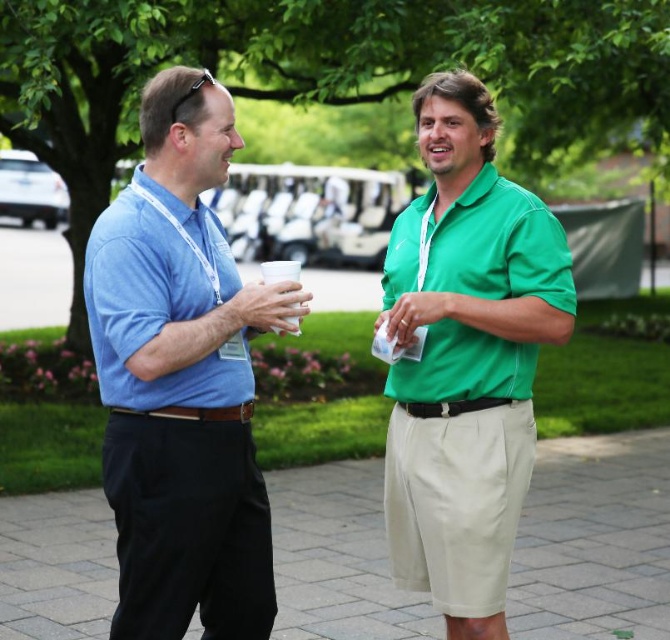
Question: In this image, where is paved stone pavement at center located relative to matte blue polo shirt at left?

Choices:
 (A) below
 (B) above

Answer: (A)

Question: Does matte blue shirt at left come in front of paved stone pavement at center?

Choices:
 (A) yes
 (B) no

Answer: (A)

Question: Which point is closer to the camera?

Choices:
 (A) matte blue polo shirt at left
 (B) green leafy tree at upper center
 (C) matte blue shirt at left

Answer: (C)

Question: Where is matte blue shirt at left located in relation to matte blue polo shirt at left in the image?

Choices:
 (A) right
 (B) left

Answer: (A)

Question: Estimate the real-world distances between objects in this image. Which object is farther from the matte blue polo shirt at left?

Choices:
 (A) matte blue shirt at left
 (B) matte green polo shirt at right

Answer: (B)

Question: Which point is farther from the camera taking this photo?

Choices:
 (A) (241, 442)
 (B) (507, 396)

Answer: (B)